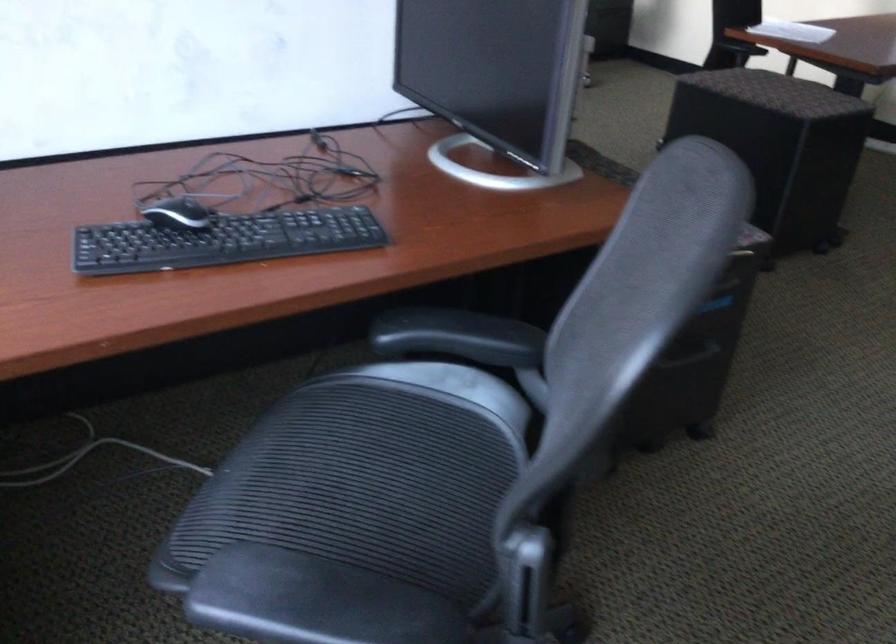
This screenshot has width=896, height=644. Find the location of `chair sitting surface`. chair sitting surface is located at coordinates (346, 520).